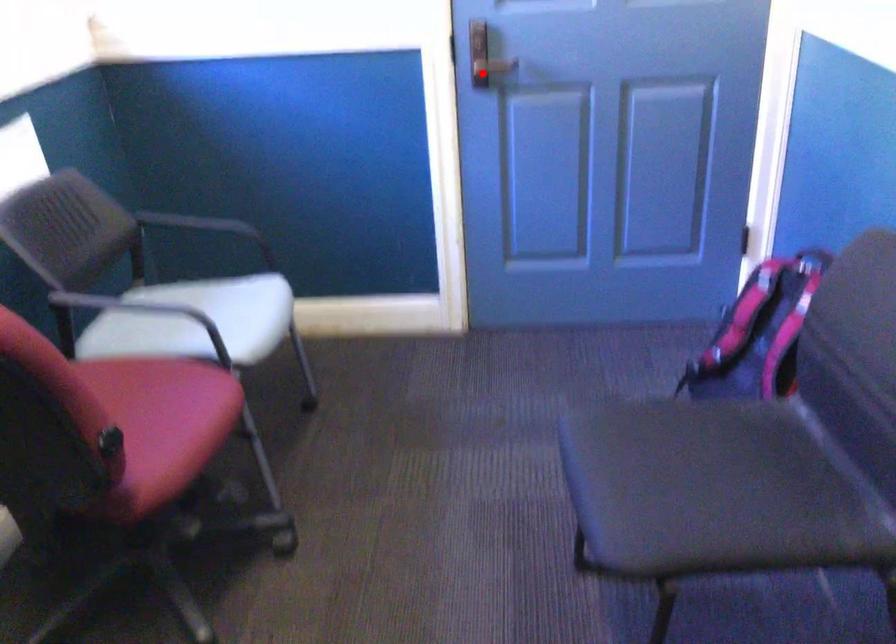
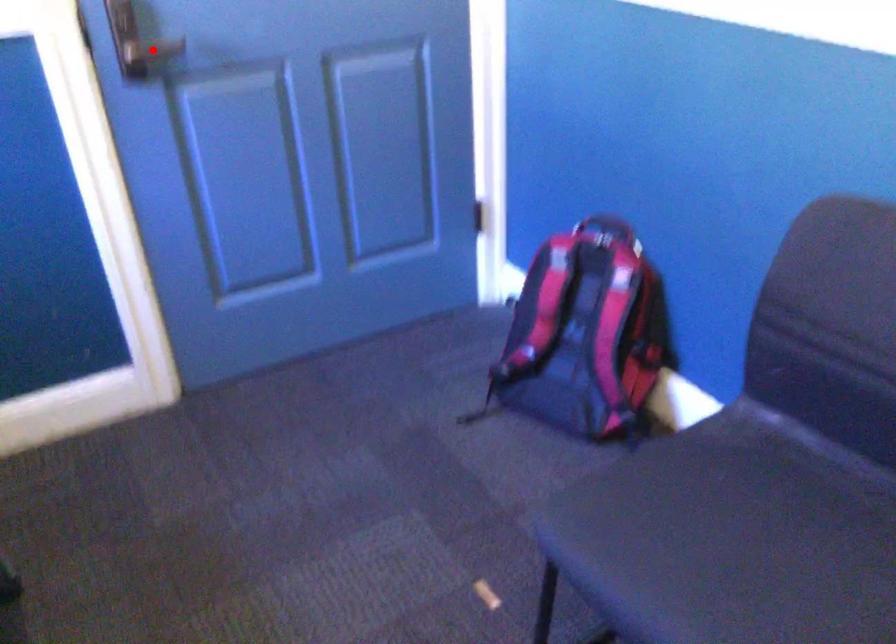
I am providing you with two images of the same scene from different viewpoints. A red point is marked on the first image and another point is marked on the second image. Do the highlighted points in image1 and image2 indicate the same real-world spot?

Yes